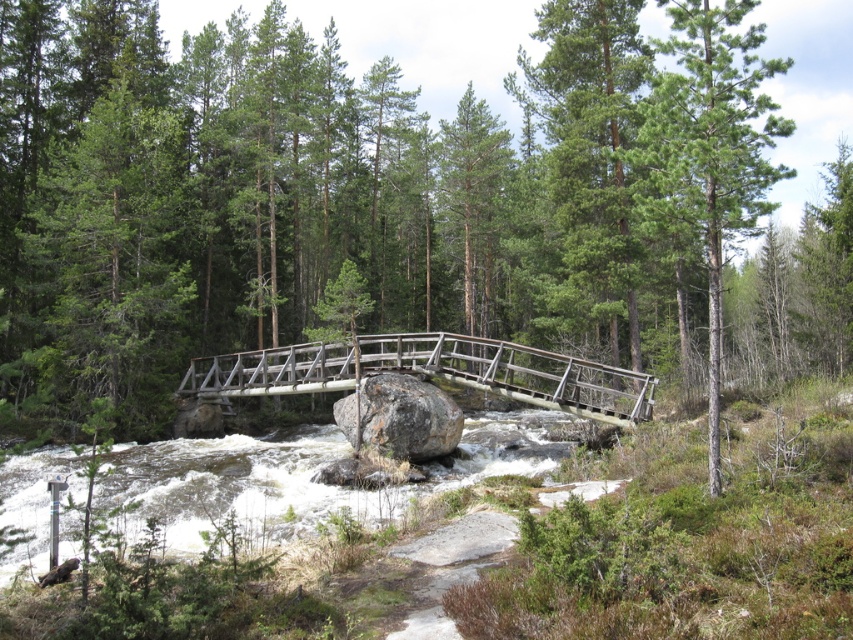
Does green matte tree at upper left appear on the left side of gray rough boulder at center?

Indeed, green matte tree at upper left is positioned on the left side of gray rough boulder at center.

Who is more forward, (122, 294) or (461, 420)?

Point (461, 420) is in front.

What do you see at coordinates (105, 275) in the screenshot? The height and width of the screenshot is (640, 853). I see `green matte tree at upper left` at bounding box center [105, 275].

Where is `green matte tree at upper left`? The width and height of the screenshot is (853, 640). green matte tree at upper left is located at coordinates [x=105, y=275].

Consider the image. Which of these two, green rough bark tree at upper center or wooden bridge at center, stands shorter?

wooden bridge at center is shorter.

Consider the image. Can you confirm if green rough bark tree at upper center is thinner than wooden bridge at center?

Correct, green rough bark tree at upper center's width is less than wooden bridge at center's.

What do you see at coordinates (712, 148) in the screenshot?
I see `green rough bark tree at upper center` at bounding box center [712, 148].

Find the location of `green rough bark tree at upper center`. green rough bark tree at upper center is located at coordinates (712, 148).

Based on the photo, can you confirm if white frothy water at center is positioned above gray rough boulder at center?

Incorrect, white frothy water at center is not positioned above gray rough boulder at center.

Between point (187, 477) and point (403, 445), which one is positioned in front?

Point (187, 477) is in front.

Image resolution: width=853 pixels, height=640 pixels. In order to click on white frothy water at center in this screenshot , I will do `click(299, 477)`.